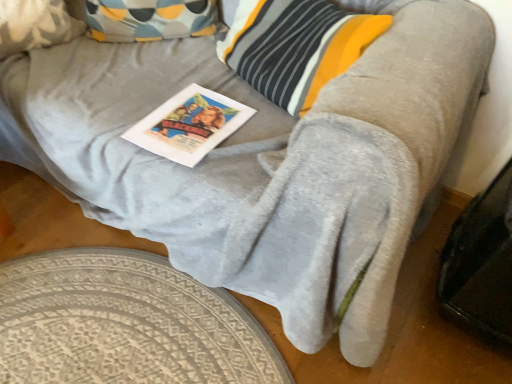
Where is `vacant space situated above white paper magazine at center (from a real-world perspective)`? vacant space situated above white paper magazine at center (from a real-world perspective) is located at coordinates (193, 121).